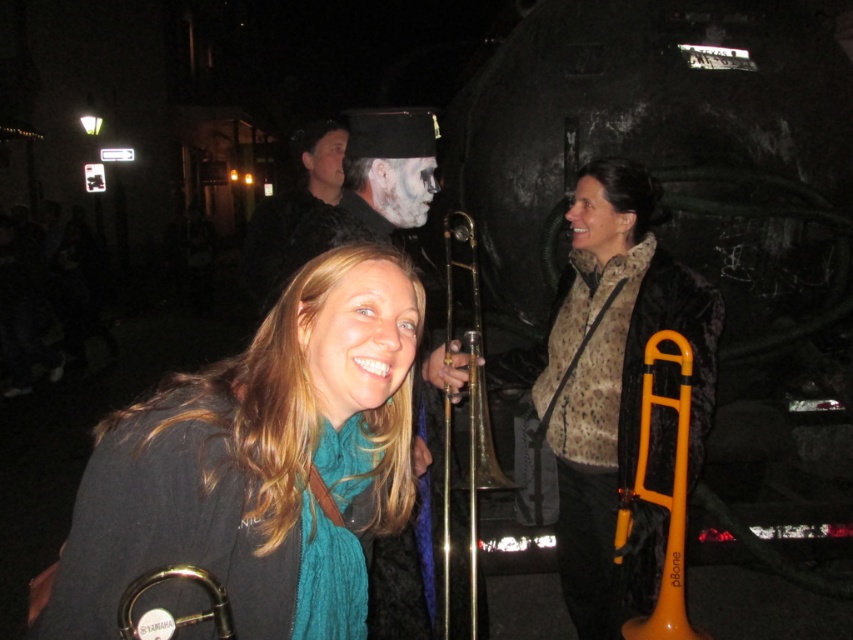
Can you confirm if matte black jacket at center is positioned to the left of orange plastic trombone at center?

Correct, you'll find matte black jacket at center to the left of orange plastic trombone at center.

What do you see at coordinates (260, 461) in the screenshot? This screenshot has width=853, height=640. I see `matte black jacket at center` at bounding box center [260, 461].

Describe the element at coordinates (260, 461) in the screenshot. This screenshot has height=640, width=853. I see `matte black jacket at center` at that location.

This screenshot has width=853, height=640. In order to click on matte black jacket at center in this screenshot , I will do `click(260, 461)`.

Does matte black trombone at center have a greater height compared to metallic gold trombone at center?

Yes.

Consider the image. Who is positioned more to the right, matte black trombone at center or metallic gold trombone at center?

metallic gold trombone at center

Image resolution: width=853 pixels, height=640 pixels. I want to click on matte black trombone at center, so click(x=375, y=182).

Between gold brass trumpet at center and orange plastic trombone at center, which one appears on the right side from the viewer's perspective?

Positioned to the right is orange plastic trombone at center.

Can you confirm if gold brass trumpet at center is smaller than orange plastic trombone at center?

No.

Between point (474, 552) and point (646, 384), which one is positioned in front?

Point (474, 552) is in front.

Locate an element on the screen. gold brass trumpet at center is located at coordinates (473, 404).